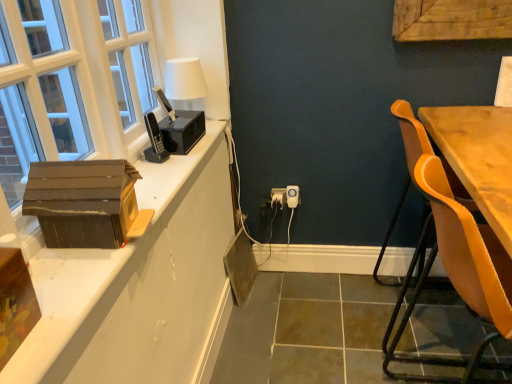
Question: Based on their sizes in the image, would you say white plastic electric outlet at center is bigger or smaller than brown wood cabinetry at left?

Choices:
 (A) big
 (B) small

Answer: (B)

Question: Is white plastic electric outlet at center inside the boundaries of brown wood cabinetry at left, or outside?

Choices:
 (A) outside
 (B) inside

Answer: (A)

Question: Which object is positioned closest to the leatherette chair at right?

Choices:
 (A) white matte table lamp at upper left
 (B) brown cardboard box at left, the second cardboard box in the front-to-back sequence
 (C) white plastic electric outlet at center
 (D) white plastic power outlet at center
 (E) brown wood cabinetry at left

Answer: (B)

Question: Estimate the real-world distances between objects in this image. Which object is farther from the white matte table lamp at upper left?

Choices:
 (A) brown wood cabinetry at left
 (B) brown cardboard box at left, the second cardboard box in the front-to-back sequence
 (C) white plastic power outlet at center
 (D) white plastic electric outlet at center
 (E) leatherette chair at right

Answer: (E)